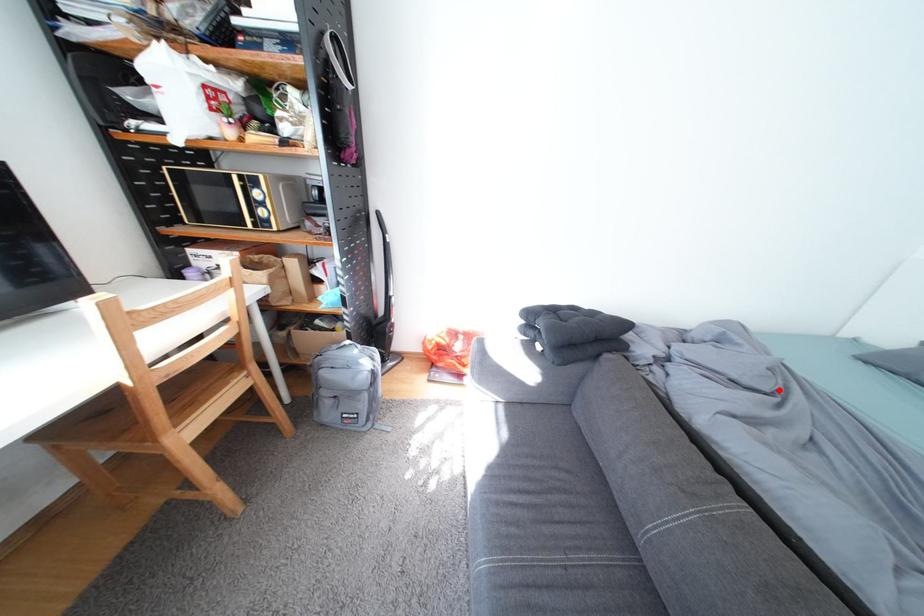
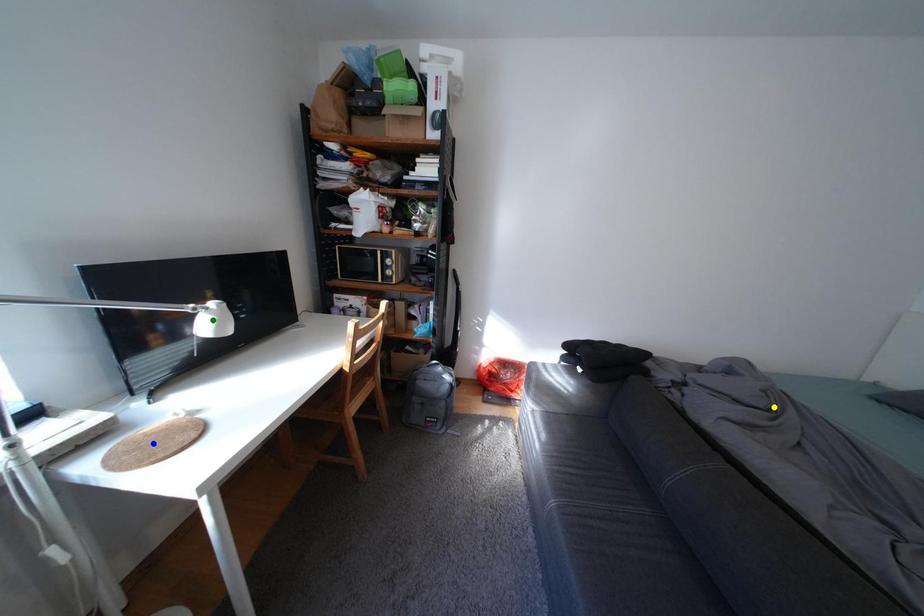
Question: I am providing you with two images of the same scene from different viewpoints. A red point is marked on the first image. You are given multiple points on the second image. Which point in image 2 is actually the same real-world point as the red point in image 1?

Choices:
 (A) green point
 (B) yellow point
 (C) blue point

Answer: (B)